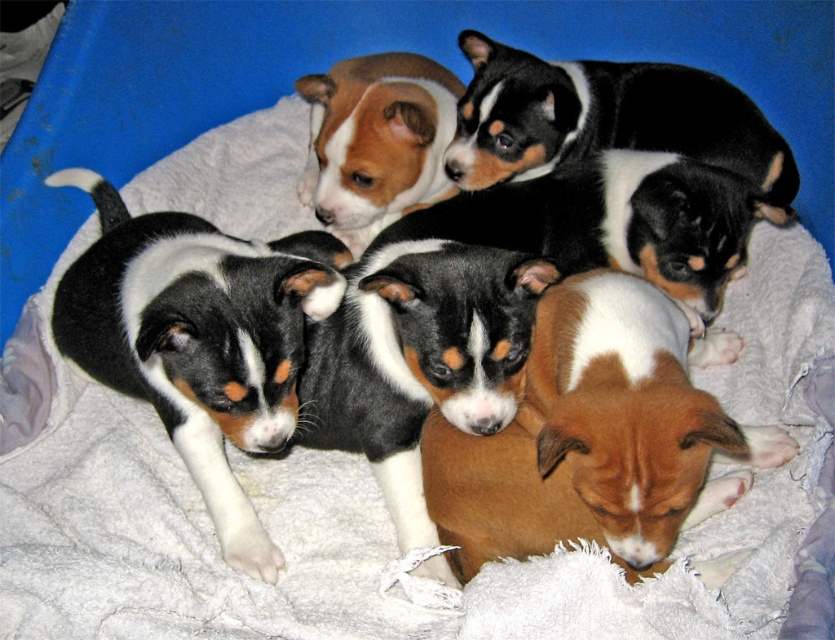
Which is more to the left, brown fur at center or black and white fur puppy at center?

black and white fur puppy at center is more to the left.

Is brown fur at center closer to camera compared to black and white fur puppy at center?

Yes.

Is point (519, 449) less distant than point (246, 273)?

No, (519, 449) is further to viewer.

The width and height of the screenshot is (835, 640). I want to click on brown fur at center, so click(x=595, y=436).

Can you confirm if brown fur at center is positioned to the left of black and white fur at upper center?

Yes, brown fur at center is to the left of black and white fur at upper center.

In the scene shown: Who is more forward, (463, 552) or (532, 97)?

Point (463, 552)

Where is `brown fur at center`? This screenshot has height=640, width=835. brown fur at center is located at coordinates (595, 436).

Between black and white fur puppy at center and black and white fur at upper center, which one has more height?

black and white fur puppy at center is taller.

Is black and white fur puppy at center closer to the viewer compared to black and white fur at upper center?

Yes, it is in front of black and white fur at upper center.

Does point (142, 282) come in front of point (608, 72)?

That is True.

Find the location of a particular element. black and white fur puppy at center is located at coordinates (198, 339).